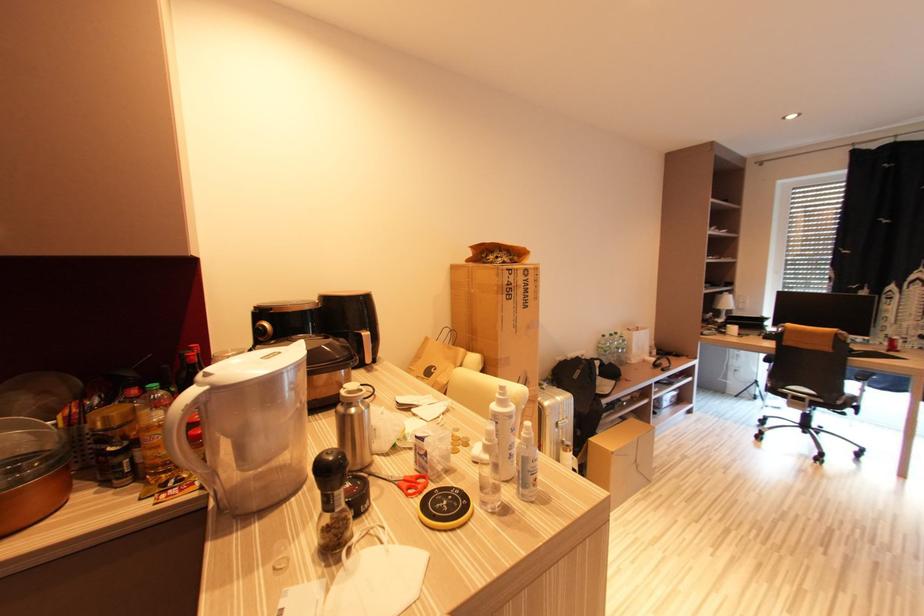
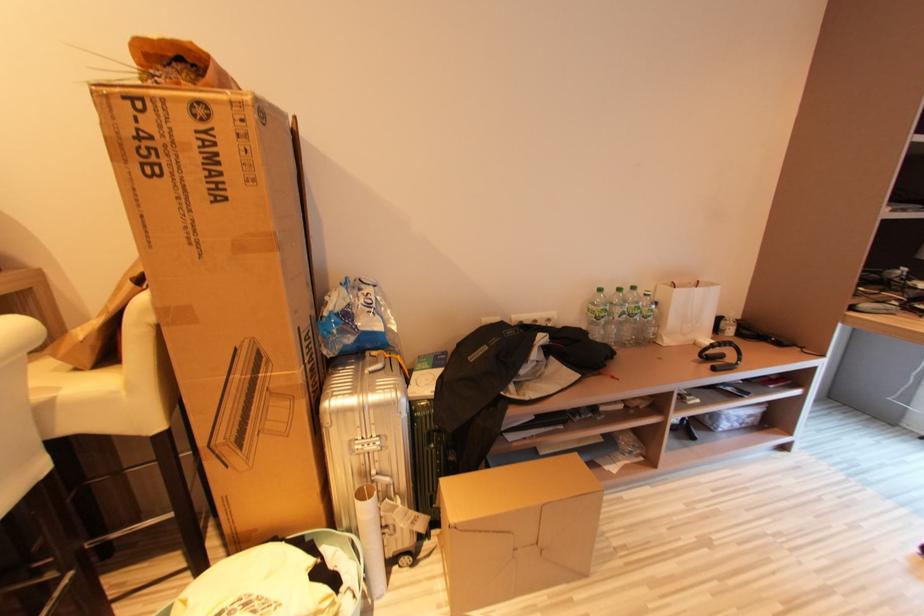
Consider the image. What movement of the cameraman would produce the second image?

The cameraman moved toward right, forward.